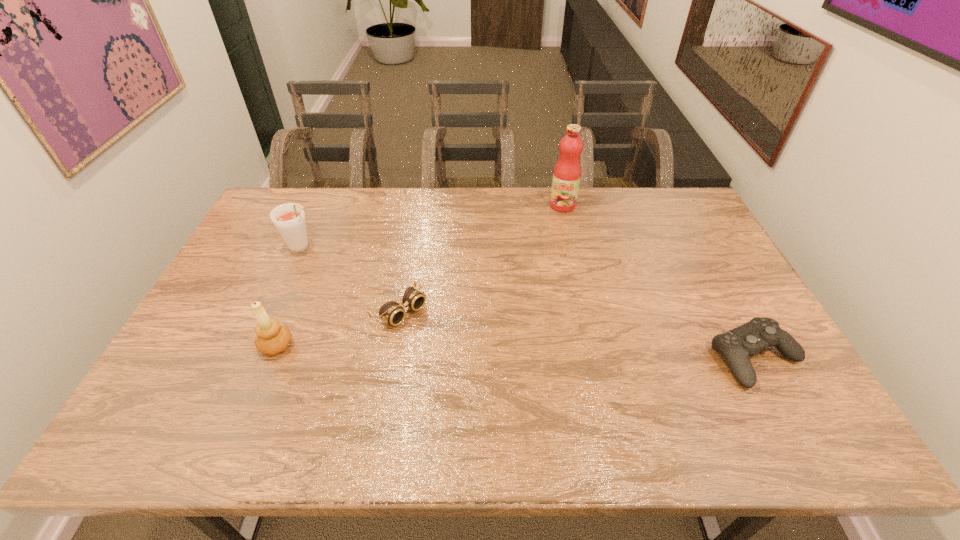
Where is `candle_holder`? The width and height of the screenshot is (960, 540). candle_holder is located at coordinates (272, 338).

The width and height of the screenshot is (960, 540). In order to click on control in this screenshot , I will do `click(736, 345)`.

The width and height of the screenshot is (960, 540). Find the location of `the rightmost object`. the rightmost object is located at coordinates (736, 345).

Locate an element on the screen. The width and height of the screenshot is (960, 540). the farthest object is located at coordinates (567, 172).

At what (x,y) coordinates should I click in order to perform the action: click on the second object from right to left. Please return your answer as a coordinate pair (x, y). This screenshot has height=540, width=960. Looking at the image, I should click on (567, 172).

Where is `the fourth nearest object`? The width and height of the screenshot is (960, 540). the fourth nearest object is located at coordinates (289, 219).

In order to click on the third object from right to left in this screenshot , I will do `click(391, 312)`.

You are a GUI agent. You are given a task and a screenshot of the screen. Output one action in this format:
    pyautogui.click(x=<x>, y=<y>)
    Task: Click on the shortest object
    
    Given the screenshot: What is the action you would take?
    pyautogui.click(x=391, y=312)

Find the location of `vacant region located 0.090m on the front of the candle_holder`. vacant region located 0.090m on the front of the candle_holder is located at coordinates (258, 392).

In order to click on free space located on the left of the control in this screenshot , I will do `click(566, 357)`.